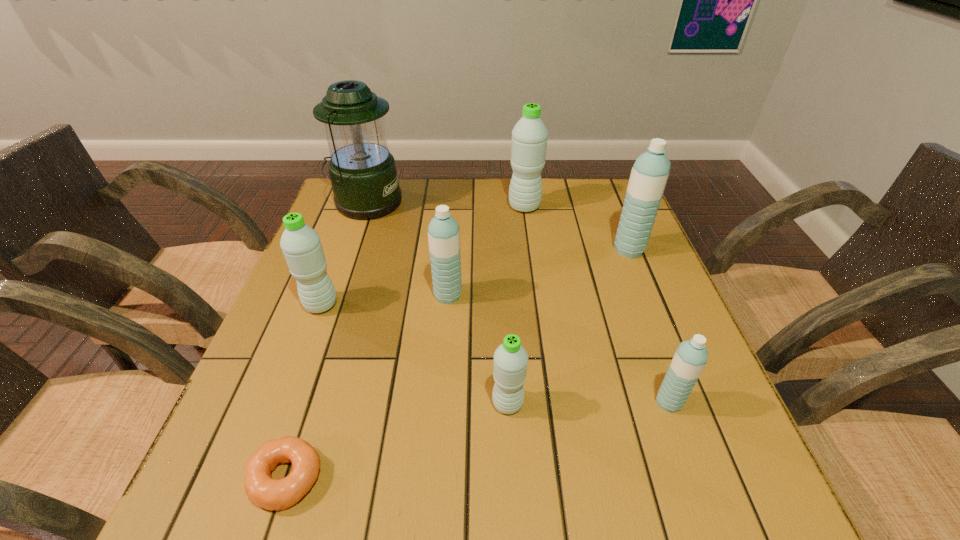
The width and height of the screenshot is (960, 540). I want to click on free point between the farthest blue water bottle and the fifth object from right to left, so click(539, 273).

Locate an element on the screen. Image resolution: width=960 pixels, height=540 pixels. unoccupied position between the nearest blue water bottle and the doughnut is located at coordinates (477, 440).

At what (x,y) coordinates should I click in order to perform the action: click on empty location between the rightmost green water bottle and the leftmost green water bottle. Please return your answer as a coordinate pair (x, y). The width and height of the screenshot is (960, 540). Looking at the image, I should click on (422, 256).

Locate an element on the screen. The image size is (960, 540). blank region between the leftmost water bottle and the shortest object is located at coordinates (303, 392).

This screenshot has height=540, width=960. I want to click on empty space between the second farthest blue water bottle and the fourth water bottle from right to left, so click(x=478, y=349).

Identify which object is the seventh nearest to the nearest blue water bottle. Please provide its 2D coordinates. Your answer should be formatted as a tuple, i.e. [(x, y)], where the tuple contains the x and y coordinates of a point satisfying the conditions above.

[(363, 174)]

Where is `object that can be found as the third closest to the fourth water bottle from left to right`? object that can be found as the third closest to the fourth water bottle from left to right is located at coordinates (444, 232).

In order to click on water bottle that stands as the closest to the rightmost green water bottle in this screenshot , I will do `click(650, 172)`.

The height and width of the screenshot is (540, 960). I want to click on water bottle that is the fourth closest one to the green lantern, so click(650, 172).

Identify which green water bottle is the closest to the biggest blue water bottle. Please provide its 2D coordinates. Your answer should be formatted as a tuple, i.e. [(x, y)], where the tuple contains the x and y coordinates of a point satisfying the conditions above.

[(529, 136)]